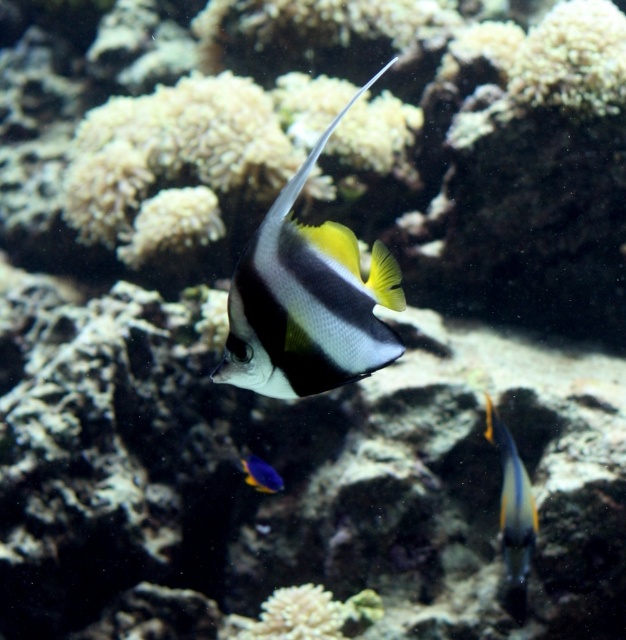
Which is below, black and white striped fish at center or white coral at center?

white coral at center is lower down.

In the scene shown: Does black and white striped fish at center lie behind white coral at center?

That is False.

Who is more forward, (x=262, y=362) or (x=285, y=604)?

Point (x=262, y=362) is in front.

You are a GUI agent. You are given a task and a screenshot of the screen. Output one action in this format:
    pyautogui.click(x=<x>, y=<y>)
    Task: Click on the black and white striped fish at center
    The width and height of the screenshot is (626, 640).
    Given the screenshot: What is the action you would take?
    pyautogui.click(x=307, y=301)

Is black and white striped fish at center to the right of shiny blue fish at lower center from the viewer's perspective?

Yes, black and white striped fish at center is to the right of shiny blue fish at lower center.

Measure the distance between point (294, 381) and camera.

Point (294, 381) and camera are 37.09 inches apart from each other.

Locate an element on the screen. black and white striped fish at center is located at coordinates (307, 301).

The image size is (626, 640). What are the coordinates of `black and white striped fish at center` in the screenshot? It's located at (307, 301).

Can you confirm if black and white striped fish at center is taller than shiny blue and yellow fish at center?

No.

Which is behind, point (371, 266) or point (526, 572)?

Point (526, 572)

Identify the location of black and white striped fish at center. (307, 301).